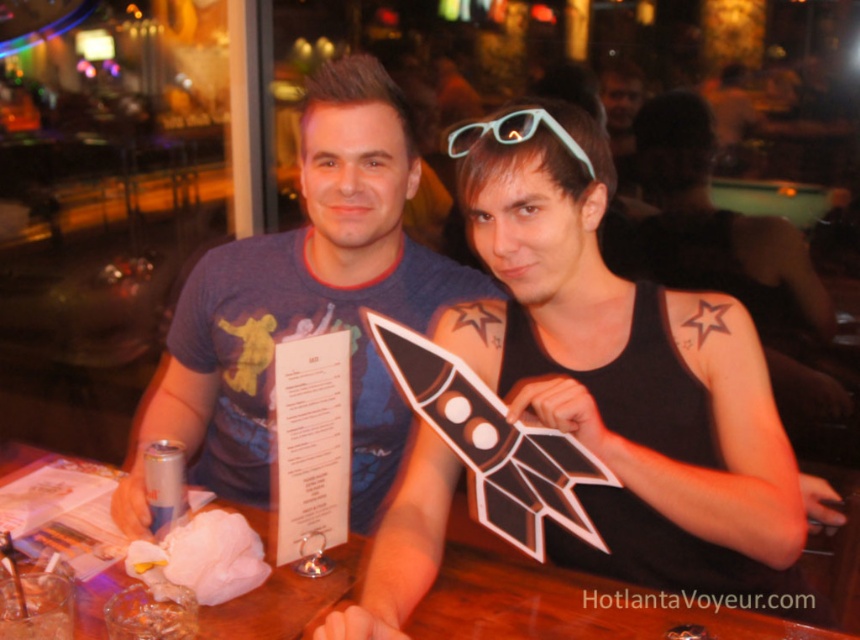
You are a photographer taking a picture of the scene. You notice two points in the image labeled as point (172, 424) and point (530, 132). Which point is closer to your camera?

Point (172, 424) is further to the camera than point (530, 132), so the point closer to the camera is point (530, 132).

You are a photographer trying to capture the blue cotton t shirt at center in your shot. The camera has a focus point at coordinate point (310, 298). Will this point help you focus on the blue cotton t shirt at center?

Yes, the point (310, 298) marks the blue cotton t shirt at center, so focusing there will capture it.